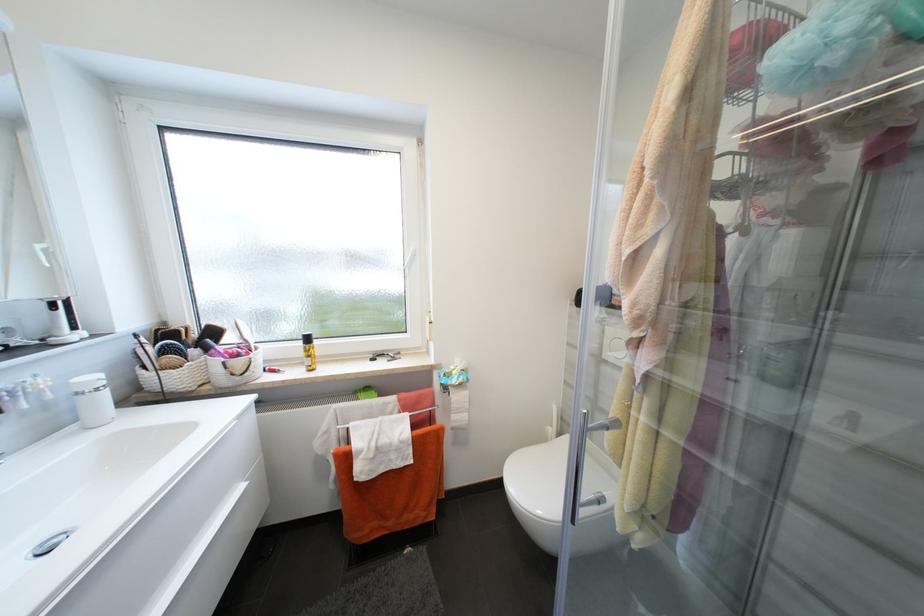
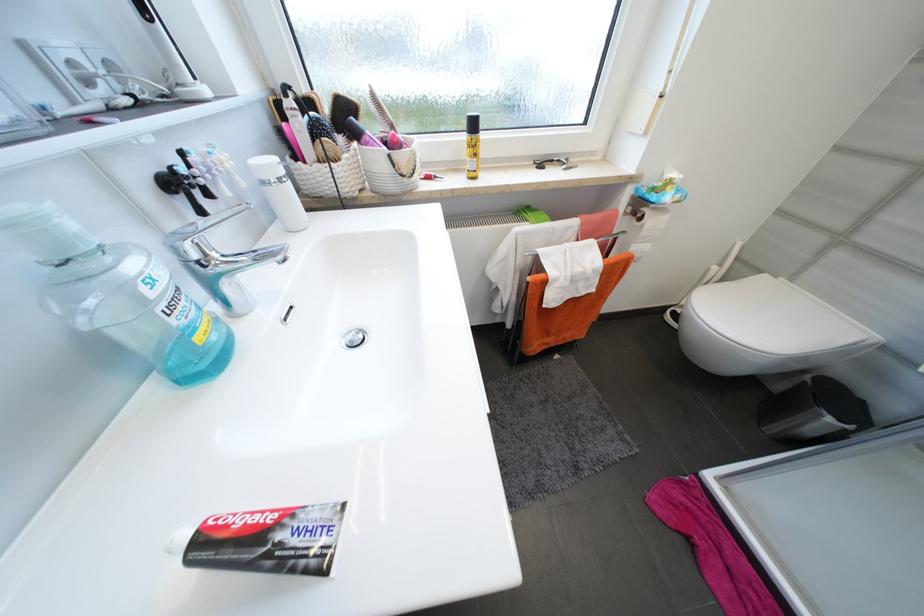
Locate, in the second image, the point that corresponds to [313,363] in the first image.

(477, 166)